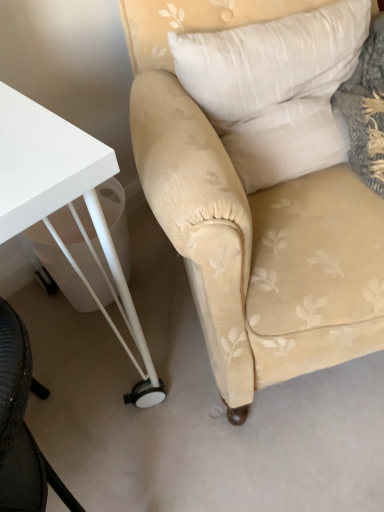
Question: Is beige fabric chair at center positioned behind white glossy table at lower left?

Choices:
 (A) no
 (B) yes

Answer: (A)

Question: Does beige fabric chair at center come in front of white glossy table at lower left?

Choices:
 (A) no
 (B) yes

Answer: (B)

Question: Is beige fabric chair at center beside white glossy table at lower left?

Choices:
 (A) no
 (B) yes

Answer: (A)

Question: Is beige fabric chair at center turned away from white glossy table at lower left?

Choices:
 (A) yes
 (B) no

Answer: (B)

Question: From the image's perspective, would you say beige fabric chair at center is positioned over white glossy table at lower left?

Choices:
 (A) yes
 (B) no

Answer: (A)

Question: Looking at their shapes, would you say beige fabric chair at center is wider or thinner than white glossy table at lower left?

Choices:
 (A) wide
 (B) thin

Answer: (A)

Question: Is point (329, 208) closer or farther from the camera than point (76, 215)?

Choices:
 (A) closer
 (B) farther

Answer: (A)

Question: From a real-world perspective, is beige fabric chair at center above or below white glossy table at lower left?

Choices:
 (A) above
 (B) below

Answer: (A)

Question: Is beige fabric chair at center taller or shorter than white glossy table at lower left?

Choices:
 (A) short
 (B) tall

Answer: (B)

Question: From the image's perspective, is white soft pillow at upper right above or below white glossy table at lower left?

Choices:
 (A) above
 (B) below

Answer: (A)

Question: Considering the positions of white soft pillow at upper right and white glossy table at lower left in the image, is white soft pillow at upper right taller or shorter than white glossy table at lower left?

Choices:
 (A) short
 (B) tall

Answer: (A)

Question: Is white soft pillow at upper right bigger or smaller than white glossy table at lower left?

Choices:
 (A) big
 (B) small

Answer: (B)

Question: Is white soft pillow at upper right to the left or to the right of white glossy table at lower left in the image?

Choices:
 (A) left
 (B) right

Answer: (B)

Question: Would you say white glossy table at lower left is to the left or to the right of beige fabric chair at center in the picture?

Choices:
 (A) right
 (B) left

Answer: (B)

Question: From the image's perspective, is white glossy table at lower left located above or below beige fabric chair at center?

Choices:
 (A) above
 (B) below

Answer: (B)